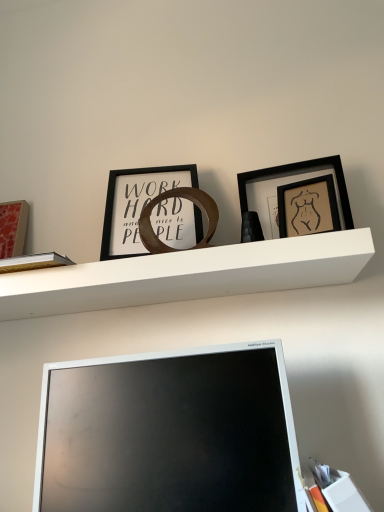
Question: Should I look upward or downward to see matte silver monitor at lower center?

Choices:
 (A) up
 (B) down

Answer: (B)

Question: Is the surface of black matte picture frame at center, which is counted as the second picture frame, starting from the left, in direct contact with matte black picture frame at upper right, which ranks as the 3th picture frame in left-to-right order?

Choices:
 (A) no
 (B) yes

Answer: (A)

Question: Can you confirm if black matte picture frame at center, which is counted as the second picture frame, starting from the left, is taller than matte black picture frame at upper right, the first picture frame from the right?

Choices:
 (A) no
 (B) yes

Answer: (B)

Question: Considering the relative sizes of black matte picture frame at center, the 2th picture frame positioned from the right, and matte black picture frame at upper right, which ranks as the 3th picture frame in left-to-right order, in the image provided, is black matte picture frame at center, the 2th picture frame positioned from the right, thinner than matte black picture frame at upper right, which ranks as the 3th picture frame in left-to-right order,?

Choices:
 (A) yes
 (B) no

Answer: (B)

Question: From the image's perspective, is black matte picture frame at center, which is counted as the second picture frame, starting from the left, located above matte black picture frame at upper right, which ranks as the 3th picture frame in left-to-right order?

Choices:
 (A) no
 (B) yes

Answer: (B)

Question: Is black matte picture frame at center, the 2th picture frame positioned from the right, positioned before matte black picture frame at upper right, which ranks as the 3th picture frame in left-to-right order?

Choices:
 (A) yes
 (B) no

Answer: (A)

Question: Can you confirm if black matte picture frame at center, the 2th picture frame positioned from the right, is bigger than matte black picture frame at upper right, the first picture frame from the right?

Choices:
 (A) no
 (B) yes

Answer: (B)

Question: From the image's perspective, would you say matte silver monitor at lower center is positioned over matte red picture frame at left, the third picture frame viewed from the right?

Choices:
 (A) yes
 (B) no

Answer: (B)

Question: Is matte silver monitor at lower center thinner than matte red picture frame at left, the third picture frame viewed from the right?

Choices:
 (A) yes
 (B) no

Answer: (B)

Question: Is matte silver monitor at lower center touching matte red picture frame at left, the third picture frame viewed from the right?

Choices:
 (A) yes
 (B) no

Answer: (B)

Question: Does matte silver monitor at lower center contain matte red picture frame at left, placed as the first picture frame when sorted from left to right?

Choices:
 (A) no
 (B) yes

Answer: (A)

Question: Does matte silver monitor at lower center appear on the left side of matte red picture frame at left, placed as the first picture frame when sorted from left to right?

Choices:
 (A) no
 (B) yes

Answer: (A)

Question: From the image's perspective, is matte silver monitor at lower center below matte red picture frame at left, the third picture frame viewed from the right?

Choices:
 (A) no
 (B) yes

Answer: (B)

Question: Is white matte shelf at center at the right side of white paper at lower right?

Choices:
 (A) no
 (B) yes

Answer: (A)